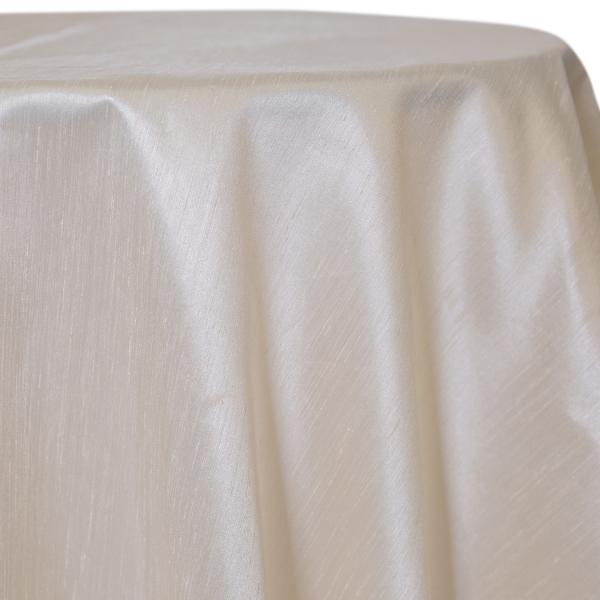
This screenshot has height=600, width=600. Find the location of `rounded edge at top of table`. rounded edge at top of table is located at coordinates (252, 77).